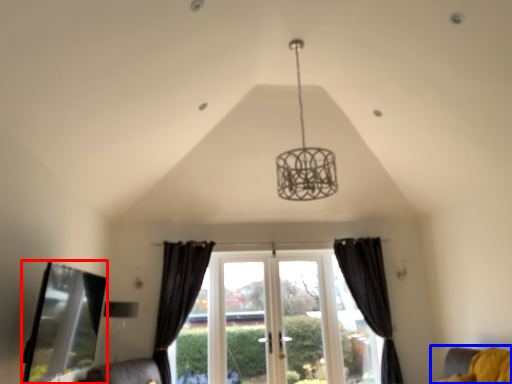
Question: Which object appears farthest to the camera in this image, bay window (highlighted by a red box) or furniture (highlighted by a blue box)?

Choices:
 (A) bay window
 (B) furniture

Answer: (B)